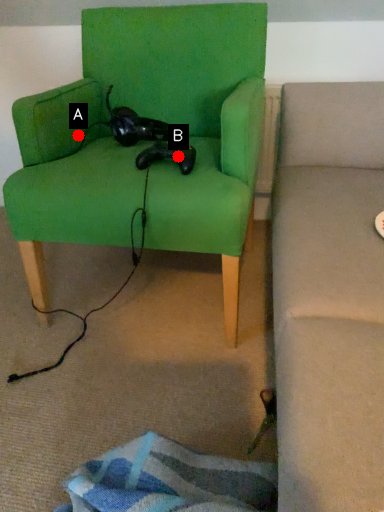
Question: Two points are circled on the image, labeled by A and B beside each circle. Among these points, which one is farthest from the camera?

Choices:
 (A) A is further
 (B) B is further

Answer: (A)